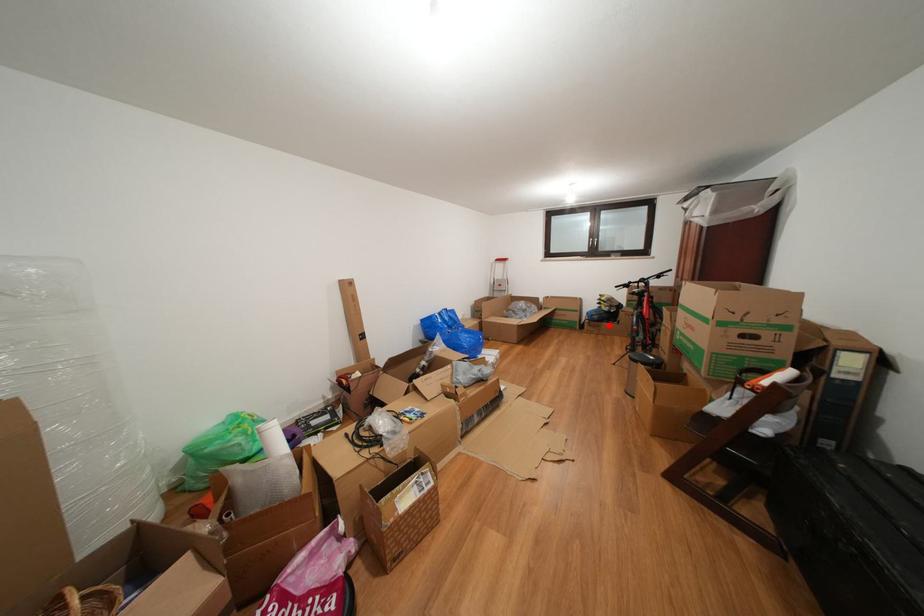
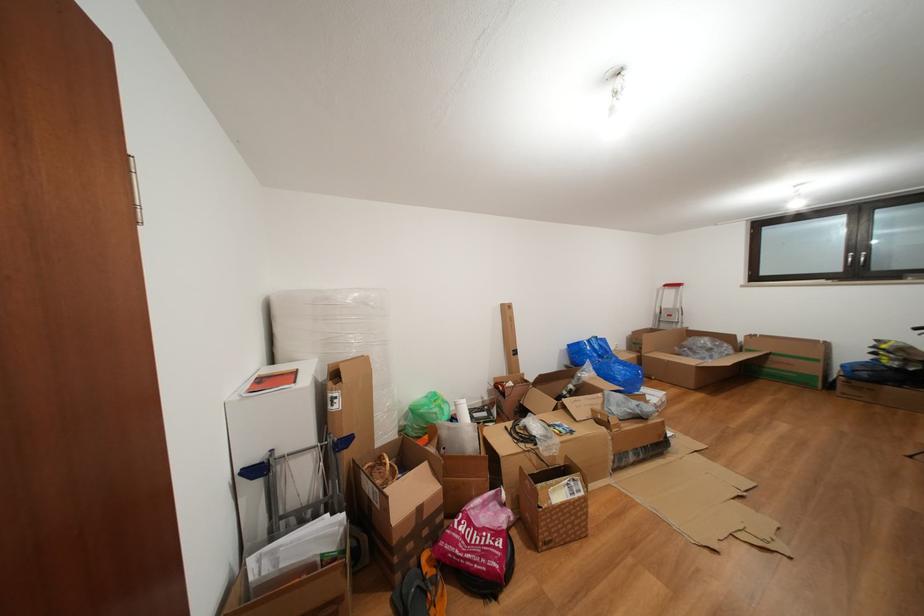
Where in the second image is the point corresponding to the highlighted location from the first image?

(886, 387)